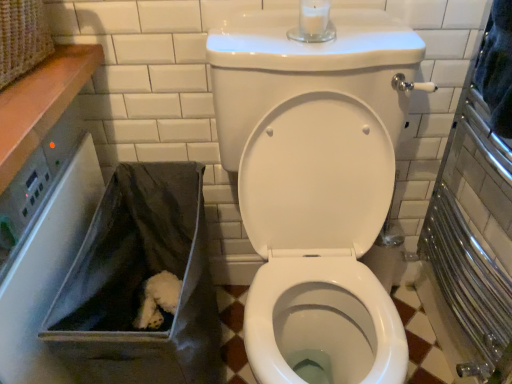
Question: From a real-world perspective, is gray fabric bag at lower left positioned above or below white glossy toilet at center?

Choices:
 (A) above
 (B) below

Answer: (B)

Question: Is gray fabric bag at lower left bigger or smaller than white glossy toilet at center?

Choices:
 (A) big
 (B) small

Answer: (B)

Question: Is gray fabric bag at lower left taller or shorter than white glossy toilet at center?

Choices:
 (A) short
 (B) tall

Answer: (A)

Question: Considering their positions, is white glossy toilet at center located in front of or behind gray fabric bag at lower left?

Choices:
 (A) front
 (B) behind

Answer: (A)

Question: Is white glossy toilet at center bigger or smaller than gray fabric bag at lower left?

Choices:
 (A) small
 (B) big

Answer: (B)

Question: Considering the relative positions of white glossy toilet at center and gray fabric bag at lower left in the image provided, is white glossy toilet at center to the left or to the right of gray fabric bag at lower left?

Choices:
 (A) right
 (B) left

Answer: (A)

Question: From a real-world perspective, is white glossy toilet at center positioned above or below gray fabric bag at lower left?

Choices:
 (A) above
 (B) below

Answer: (A)